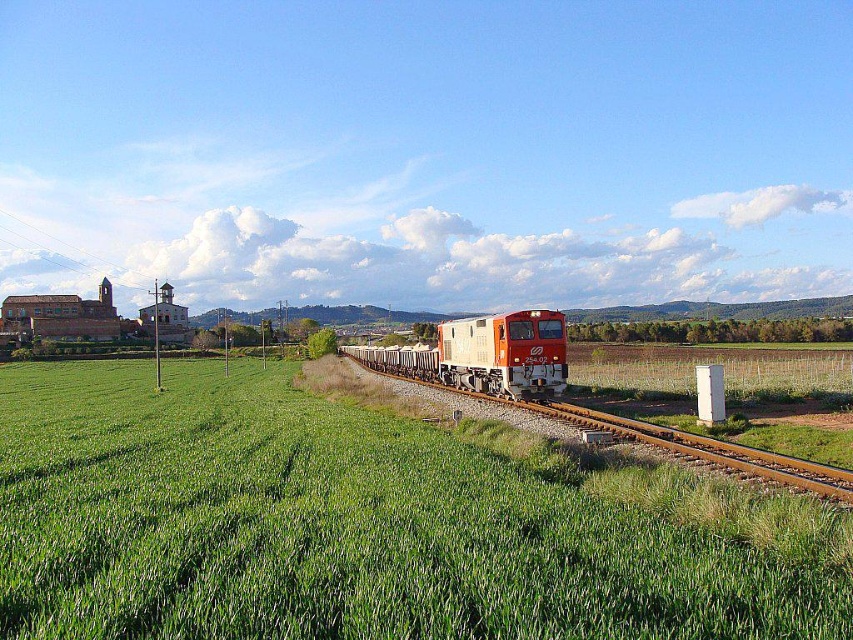
Question: Does green grass at center appear under matte orange train at center?

Choices:
 (A) no
 (B) yes

Answer: (B)

Question: Can you confirm if green grass at center is bigger than matte orange train at center?

Choices:
 (A) no
 (B) yes

Answer: (A)

Question: Observing the image, what is the correct spatial positioning of green grass at center in reference to matte orange train at center?

Choices:
 (A) below
 (B) above

Answer: (A)